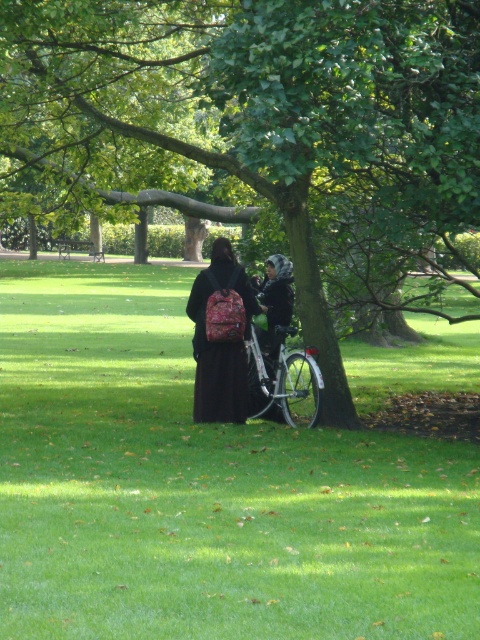
Who is positioned more to the right, green leafy tree at center or silver metallic bicycle at center?

From the viewer's perspective, silver metallic bicycle at center appears more on the right side.

Find the location of a particular element. green leafy tree at center is located at coordinates (266, 129).

From the picture: Does green grass at center appear under green leafy tree at center?

Indeed, green grass at center is positioned under green leafy tree at center.

Describe the element at coordinates (203, 488) in the screenshot. I see `green grass at center` at that location.

Which is in front, point (109, 563) or point (387, 1)?

Point (109, 563) is more forward.

Locate an element on the screen. The height and width of the screenshot is (640, 480). green grass at center is located at coordinates (203, 488).

Between green grass at center and silver metallic bicycle at center, which one is positioned lower?

silver metallic bicycle at center is lower down.

Does green grass at center have a lesser width compared to silver metallic bicycle at center?

No.

Identify the location of green grass at center. This screenshot has width=480, height=640. (203, 488).